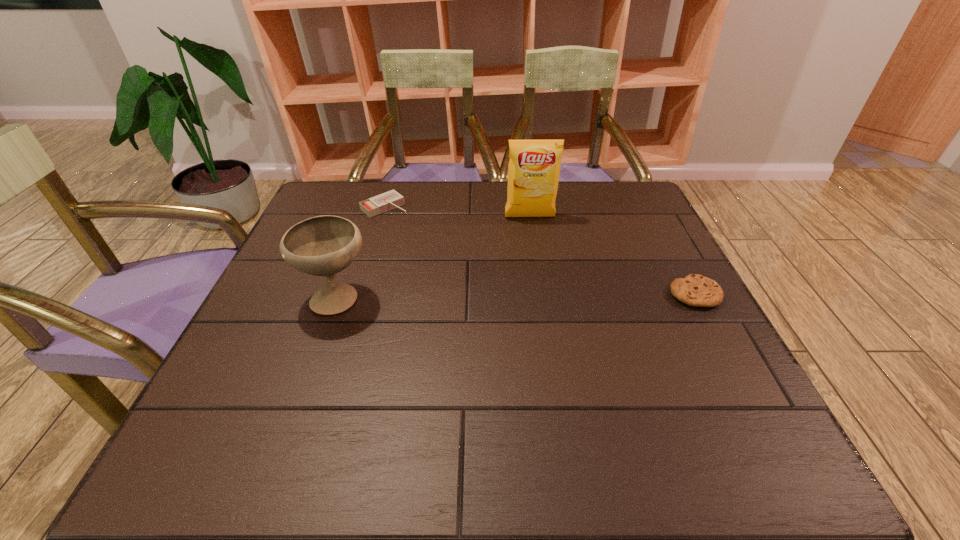
Where is `vacant space positioned on the striking surface of the matchbox`? The height and width of the screenshot is (540, 960). vacant space positioned on the striking surface of the matchbox is located at coordinates (409, 225).

In order to click on free space located 0.060m on the striking surface of the matchbox in this screenshot , I will do `click(409, 225)`.

Find the location of a particular element. free point located on the striking surface of the matchbox is located at coordinates (413, 228).

Where is `crisp (potato chip) positioned at the far edge`? crisp (potato chip) positioned at the far edge is located at coordinates [x=534, y=167].

Find the location of `matchbox at the far edge`. matchbox at the far edge is located at coordinates coord(389,200).

Where is `chalice present at the left edge`? The height and width of the screenshot is (540, 960). chalice present at the left edge is located at coordinates (324, 245).

Identify the location of matchbox present at the left edge. (389, 200).

Find the location of a particular element. The image size is (960, 540). object that is at the right edge is located at coordinates (696, 290).

Where is `object that is at the far left corner`? The image size is (960, 540). object that is at the far left corner is located at coordinates (389, 200).

Locate an element on the screen. vacant space at the far edge of the desktop is located at coordinates (559, 225).